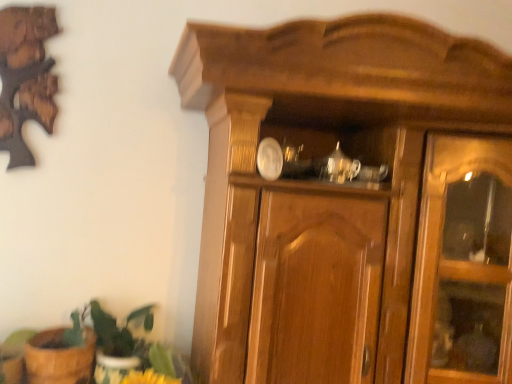
Question: Based on their positions, is green leafy plant at lower left located to the left or right of brown woven basket at lower left?

Choices:
 (A) right
 (B) left

Answer: (A)

Question: From a real-world perspective, is green leafy plant at lower left positioned above or below brown woven basket at lower left?

Choices:
 (A) above
 (B) below

Answer: (A)

Question: Is green leafy plant at lower left inside or outside of brown woven basket at lower left?

Choices:
 (A) inside
 (B) outside

Answer: (B)

Question: Considering the positions of point (33, 360) and point (25, 332), is point (33, 360) closer or farther from the camera than point (25, 332)?

Choices:
 (A) farther
 (B) closer

Answer: (B)

Question: In terms of size, does brown woven basket at lower left appear bigger or smaller than green leafy plant at lower left?

Choices:
 (A) big
 (B) small

Answer: (B)

Question: Is brown woven basket at lower left wider or thinner than green leafy plant at lower left?

Choices:
 (A) thin
 (B) wide

Answer: (A)

Question: Which is correct: brown woven basket at lower left is inside green leafy plant at lower left, or outside of it?

Choices:
 (A) inside
 (B) outside

Answer: (A)